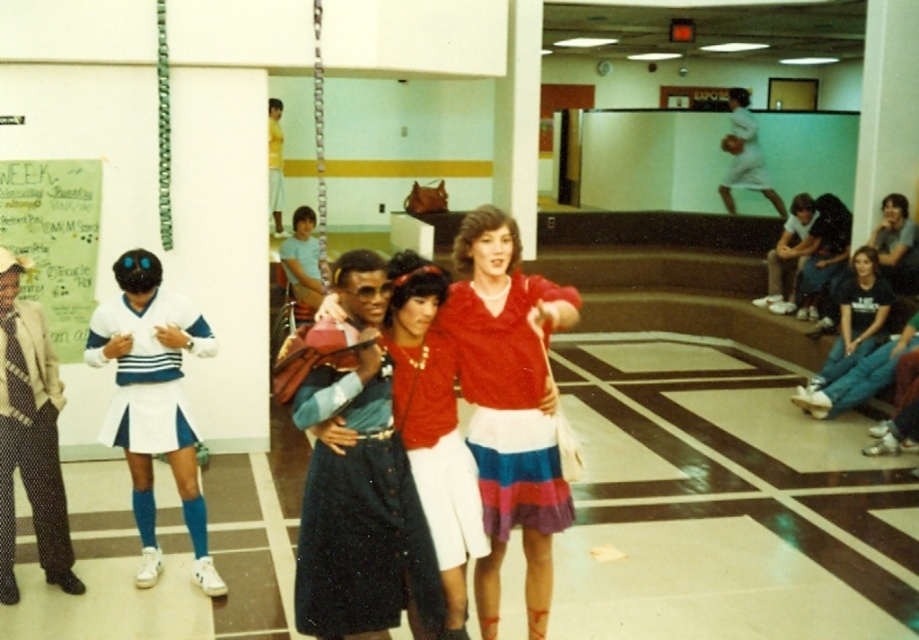
You are a photographer setting up for a group photo. You need to ensure that the matte black hair at center and the yellow fabric shirt at upper center are in focus simultaneously. Given that your camera can only maintain sharp focus within a 20 feet range, will you be able to achieve this?

The distance between matte black hair at center and yellow fabric shirt at upper center is 25.20 feet, which exceeds the camera focus range of 20 feet. Therefore, you cannot have both in focus at the same time.

You are standing at the origin of the coordinate system in the image. You want to move towards the point at the right side of the two points, point (x=194, y=433) and point (x=135, y=385). Which point should you move towards?

Point (x=194, y=433) is behind point (x=135, y=385), so the point at the right side is point (x=135, y=385). Therefore, you should move towards point (x=135, y=385).

You are standing at the center of the gymnasium and see the polka dot pants at left and the white cotton shirt at upper right. Which one is farther from you?

The polka dot pants at left is 10.73 meters away from the white cotton shirt at upper right, so the one farther from you would depend on your position. However, since the distance between them is fixed, if you are equidistant from both, neither is farther. Please clarify your position.